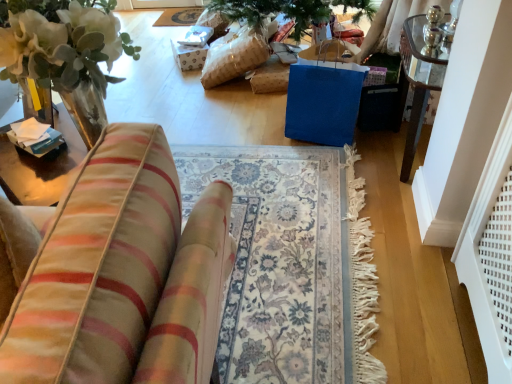
The height and width of the screenshot is (384, 512). What are the coordinates of `velvet striped cushion at left` in the screenshot? It's located at (122, 274).

What do you see at coordinates (122, 274) in the screenshot? I see `velvet striped cushion at left` at bounding box center [122, 274].

You are a GUI agent. You are given a task and a screenshot of the screen. Output one action in this format:
    pyautogui.click(x=<x>, y=<y>)
    Task: Click on the silky blue mat at upper center
    
    Given the screenshot: What is the action you would take?
    pyautogui.click(x=179, y=16)

What do you see at coordinates (179, 16) in the screenshot?
I see `silky blue mat at upper center` at bounding box center [179, 16].

Where is `velvet striped cushion at left`? The width and height of the screenshot is (512, 384). velvet striped cushion at left is located at coordinates (122, 274).

Which object is positioned more to the left, velvet striped cushion at left or silky blue mat at upper center?

silky blue mat at upper center.

Does velvet striped cushion at left lie in front of silky blue mat at upper center?

Yes, velvet striped cushion at left is closer to the camera.

Does point (192, 221) lie behind point (182, 11)?

That is False.

From the image's perspective, is velvet striped cushion at left beneath silky blue mat at upper center?

Correct, velvet striped cushion at left appears lower than silky blue mat at upper center in the image.

From a real-world perspective, is velvet striped cushion at left beneath silky blue mat at upper center?

Actually, velvet striped cushion at left is physically above silky blue mat at upper center in the real world.

In terms of width, does velvet striped cushion at left look wider or thinner when compared to silky blue mat at upper center?

Considering their sizes, velvet striped cushion at left looks slimmer than silky blue mat at upper center.

Considering the relative sizes of velvet striped cushion at left and silky blue mat at upper center in the image provided, is velvet striped cushion at left taller than silky blue mat at upper center?

Correct, velvet striped cushion at left is much taller as silky blue mat at upper center.

In terms of size, does velvet striped cushion at left appear bigger or smaller than silky blue mat at upper center?

In the image, velvet striped cushion at left appears to be larger than silky blue mat at upper center.

Would you say velvet striped cushion at left is inside or outside silky blue mat at upper center?

velvet striped cushion at left is spatially situated outside silky blue mat at upper center.

From the picture: Are velvet striped cushion at left and silky blue mat at upper center located far from each other?

Yes, velvet striped cushion at left and silky blue mat at upper center are quite far apart.

Could you tell me if velvet striped cushion at left is turned towards silky blue mat at upper center?

No, velvet striped cushion at left is not facing towards silky blue mat at upper center.

Locate an element on the screen. The height and width of the screenshot is (384, 512). furniture on the right of silky blue mat at upper center is located at coordinates (122, 274).

Which is more to the left, silky blue mat at upper center or velvet striped cushion at left?

silky blue mat at upper center.

Is silky blue mat at upper center positioned behind velvet striped cushion at left?

Yes, it is behind velvet striped cushion at left.

Is point (176, 24) closer or farther from the camera than point (187, 298)?

Point (176, 24) is farther from the camera than point (187, 298).

From the image's perspective, between silky blue mat at upper center and velvet striped cushion at left, which one is located above?

silky blue mat at upper center is shown above in the image.

From a real-world perspective, is silky blue mat at upper center physically above velvet striped cushion at left?

No, from a real-world perspective, silky blue mat at upper center is not over velvet striped cushion at left

Looking at this image, which of these two, silky blue mat at upper center or velvet striped cushion at left, is wider?

silky blue mat at upper center.

Consider the image. Between silky blue mat at upper center and velvet striped cushion at left, which one has more height?

With more height is velvet striped cushion at left.

Considering the sizes of objects silky blue mat at upper center and velvet striped cushion at left in the image provided, who is bigger, silky blue mat at upper center or velvet striped cushion at left?

velvet striped cushion at left.

Is silky blue mat at upper center inside or outside of velvet striped cushion at left?

silky blue mat at upper center is not inside velvet striped cushion at left, it's outside.

Is there a large distance between silky blue mat at upper center and velvet striped cushion at left?

Yes, silky blue mat at upper center is far from velvet striped cushion at left.

Is silky blue mat at upper center oriented towards velvet striped cushion at left?

No.

Where is `mat below the velvet striped cushion at left (from a real-world perspective)`? The width and height of the screenshot is (512, 384). mat below the velvet striped cushion at left (from a real-world perspective) is located at coordinates pos(179,16).

Find the location of a particular element. Image resolution: width=512 pixels, height=384 pixels. mat above the velvet striped cushion at left (from the image's perspective) is located at coordinates (179, 16).

You are a GUI agent. You are given a task and a screenshot of the screen. Output one action in this format:
    pyautogui.click(x=<x>, y=<y>)
    Task: Click on the furniture lying on the right of silky blue mat at upper center
    The image size is (512, 384).
    Given the screenshot: What is the action you would take?
    (122, 274)